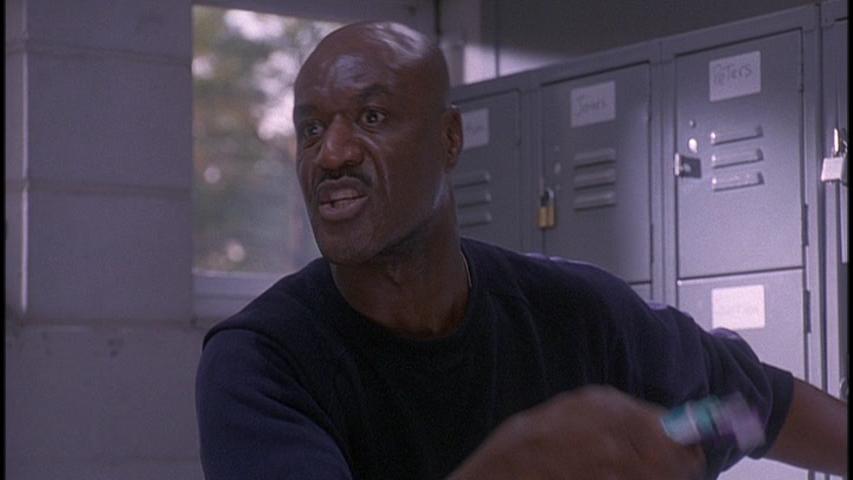
At what (x,y) coordinates should I click in order to perform the action: click on lock. Please return your answer as a coordinate pair (x, y). The width and height of the screenshot is (853, 480). Looking at the image, I should click on (692, 169), (827, 171), (543, 209).